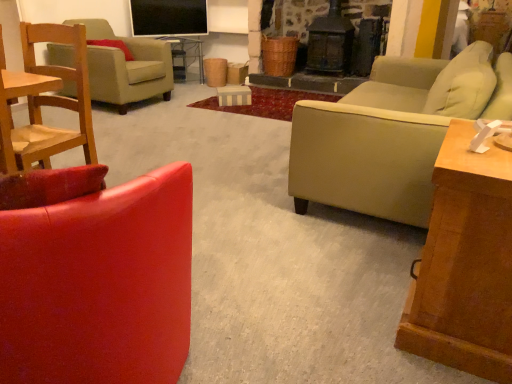
At what (x,y) coordinates should I click in order to perform the action: click on vacant area that is situated to the right of matte green armchair at left, which is counted as the 3th chair, starting from the front. Please return your answer as a coordinate pair (x, y). Looking at the image, I should click on (184, 101).